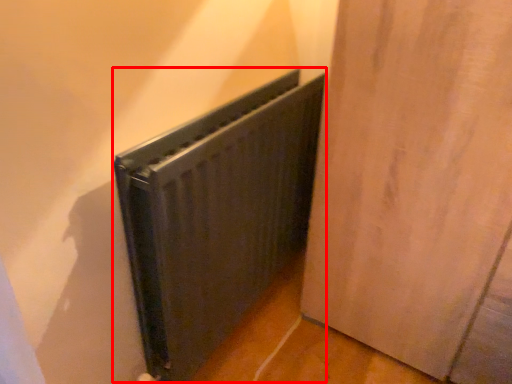
Question: From the image's perspective, what is the correct spatial positioning of radiator (annotated by the red box) in reference to door?

Choices:
 (A) below
 (B) above

Answer: (A)